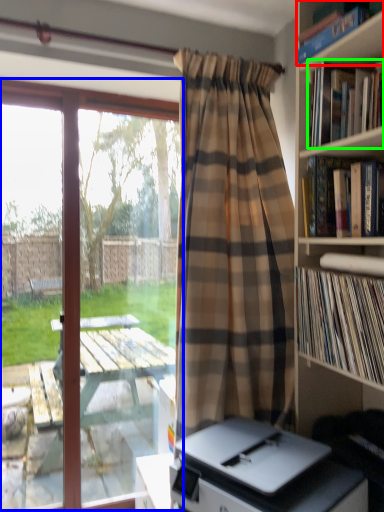
Question: Considering the real-world distances, which object is closest to book (highlighted by a red box)? window (highlighted by a blue box) or book (highlighted by a green box).

Choices:
 (A) window
 (B) book

Answer: (B)